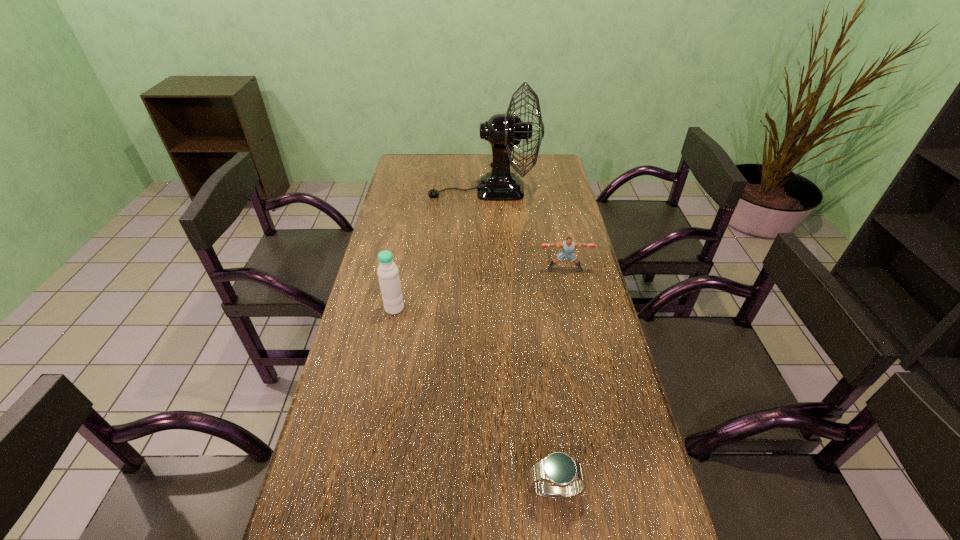
Where is `vacant region located 0.080m in front of the farthest object, indicating the direction of air flow`? vacant region located 0.080m in front of the farthest object, indicating the direction of air flow is located at coordinates click(410, 190).

At what (x,y) coordinates should I click in order to perform the action: click on free location located 0.310m on the front of the water bottle. Please return your answer as a coordinate pair (x, y). The height and width of the screenshot is (540, 960). Looking at the image, I should click on (374, 409).

At what (x,y) coordinates should I click in order to perform the action: click on vacant space located 0.340m on the front-facing side of the puncher. Please return your answer as a coordinate pair (x, y). Looking at the image, I should click on (584, 356).

The width and height of the screenshot is (960, 540). Identify the location of vacant space situated on the back of the watch. (545, 413).

At what (x,y) coordinates should I click in order to perform the action: click on object present at the far edge. Please return your answer as a coordinate pair (x, y). Looking at the image, I should click on (504, 131).

Where is `fan that is at the left edge`? fan that is at the left edge is located at coordinates (504, 131).

The width and height of the screenshot is (960, 540). I want to click on water bottle that is at the left edge, so click(x=388, y=273).

Find the location of `fan that is positioned at the right edge`. fan that is positioned at the right edge is located at coordinates (504, 131).

I want to click on puncher present at the right edge, so click(568, 245).

You are a GUI agent. You are given a task and a screenshot of the screen. Output one action in this format:
    pyautogui.click(x=<x>, y=<y>)
    Task: Click on the watch located at the right edge
    This screenshot has height=540, width=960.
    Given the screenshot: What is the action you would take?
    pyautogui.click(x=565, y=477)